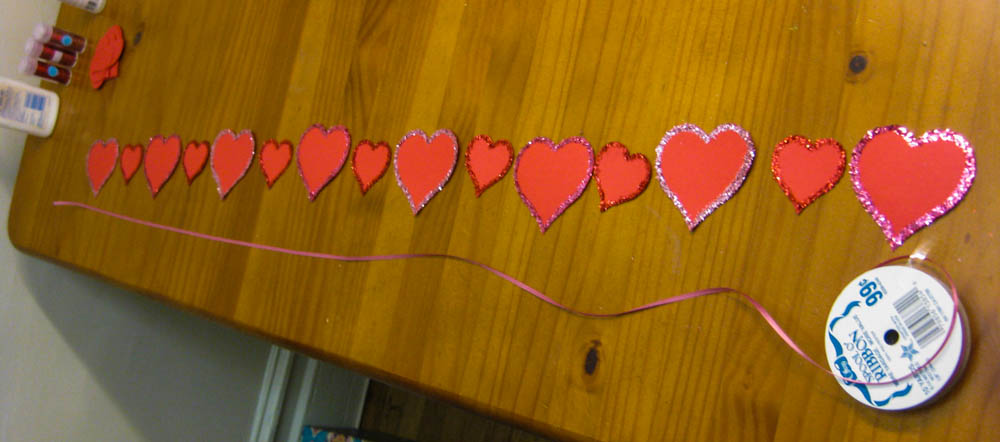
At what (x,y) coordinates should I click in order to perform the action: click on baseboard. Please return your answer as a coordinate pair (x, y). The width and height of the screenshot is (1000, 442). Looking at the image, I should click on (309, 393).